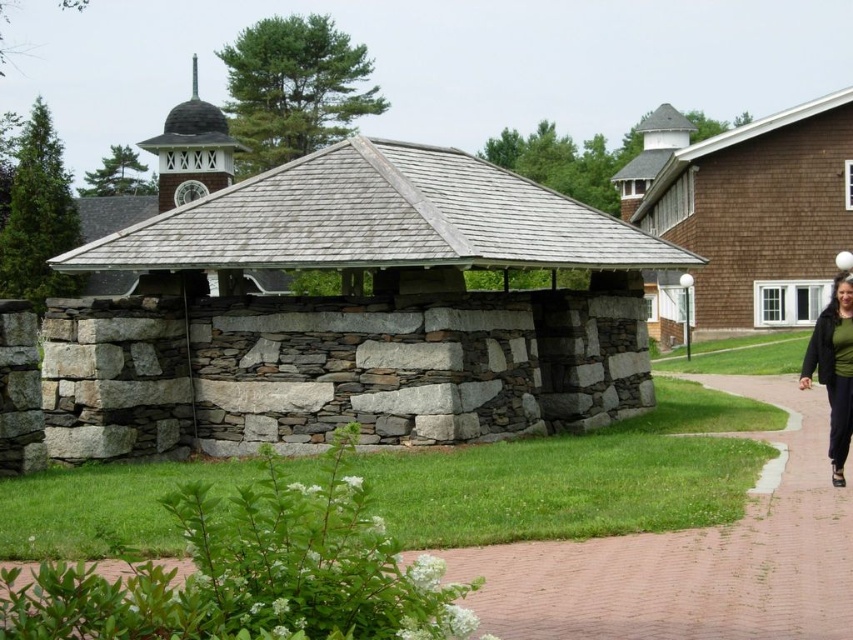
Question: Is brick pavement at lower center below green matte jacket at lower right?

Choices:
 (A) yes
 (B) no

Answer: (A)

Question: Does gray stone gazebo at center appear on the right side of green matte jacket at lower right?

Choices:
 (A) no
 (B) yes

Answer: (A)

Question: Which object is positioned closest to the gray stone gazebo at center?

Choices:
 (A) brick pavement at lower center
 (B) green matte jacket at lower right

Answer: (A)

Question: Is gray stone gazebo at center positioned at the back of brick pavement at lower center?

Choices:
 (A) yes
 (B) no

Answer: (A)

Question: Among these points, which one is farthest from the camera?

Choices:
 (A) (840, 420)
 (B) (485, 560)
 (C) (624, 353)

Answer: (C)

Question: Which of these objects is positioned farthest from the green matte jacket at lower right?

Choices:
 (A) brick pavement at lower center
 (B) gray stone gazebo at center

Answer: (B)